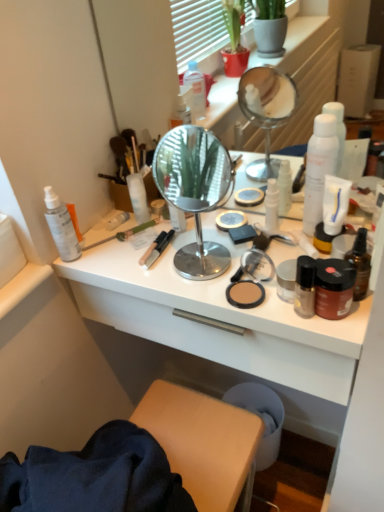
Question: Which direction should I rotate to face clear plastic tube at center, marked as the sixth toiletry in a right-to-left arrangement, — up or down?

Choices:
 (A) up
 (B) down

Answer: (A)

Question: Can we say white glossy desk at center lies outside matte gold jar at center right, the 1th toiletry positioned from the right?

Choices:
 (A) no
 (B) yes

Answer: (B)

Question: Is matte gold jar at center right, the 1th toiletry positioned from the right, inside white glossy desk at center?

Choices:
 (A) no
 (B) yes

Answer: (A)

Question: Is white glossy desk at center closer to camera compared to matte gold jar at center right, which ranks as the eighth toiletry in left-to-right order?

Choices:
 (A) no
 (B) yes

Answer: (B)

Question: Is white glossy desk at center placed right next to matte gold jar at center right, the 1th toiletry positioned from the right?

Choices:
 (A) yes
 (B) no

Answer: (B)

Question: Is white glossy desk at center far from matte gold jar at center right, which ranks as the eighth toiletry in left-to-right order?

Choices:
 (A) no
 (B) yes

Answer: (A)

Question: Does white glossy desk at center have a larger size compared to matte gold jar at center right, which ranks as the eighth toiletry in left-to-right order?

Choices:
 (A) no
 (B) yes

Answer: (B)

Question: Is white matte spray can at left, marked as the second toiletry in a left-to-right arrangement, behind white glossy bottle at center, the 5th toiletry viewed from the left?

Choices:
 (A) yes
 (B) no

Answer: (A)

Question: Does white matte spray can at left, the seventh toiletry in the right-to-left sequence, have a larger size compared to white glossy bottle at center, the 5th toiletry viewed from the left?

Choices:
 (A) yes
 (B) no

Answer: (B)

Question: Is white matte spray can at left, the seventh toiletry in the right-to-left sequence, taller than white glossy bottle at center, which is the 4th toiletry in right-to-left order?

Choices:
 (A) yes
 (B) no

Answer: (A)

Question: From a real-world perspective, is white matte spray can at left, marked as the second toiletry in a left-to-right arrangement, located beneath white glossy bottle at center, the 5th toiletry viewed from the left?

Choices:
 (A) yes
 (B) no

Answer: (A)

Question: Can you confirm if white matte spray can at left, marked as the second toiletry in a left-to-right arrangement, is shorter than white glossy bottle at center, the 5th toiletry viewed from the left?

Choices:
 (A) no
 (B) yes

Answer: (A)

Question: Is white matte spray can at left, marked as the second toiletry in a left-to-right arrangement, positioned in front of white glossy bottle at center, which is the 4th toiletry in right-to-left order?

Choices:
 (A) no
 (B) yes

Answer: (A)

Question: Would you consider brown glass bottle at right, which is counted as the second bottle, starting from the back, to be distant from white matte spray can at right, the second bottle from the front?

Choices:
 (A) no
 (B) yes

Answer: (A)